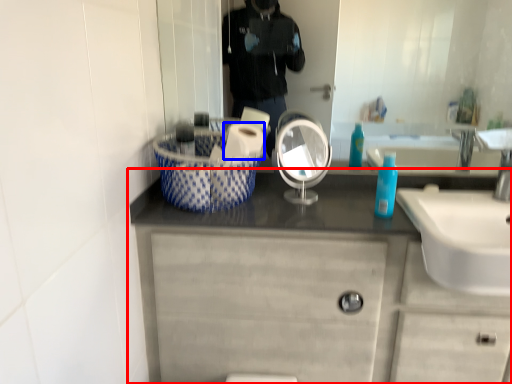
Question: Which object is closer to the camera taking this photo, bathroom cabinet (highlighted by a red box) or toilet paper (highlighted by a blue box)?

Choices:
 (A) bathroom cabinet
 (B) toilet paper

Answer: (A)